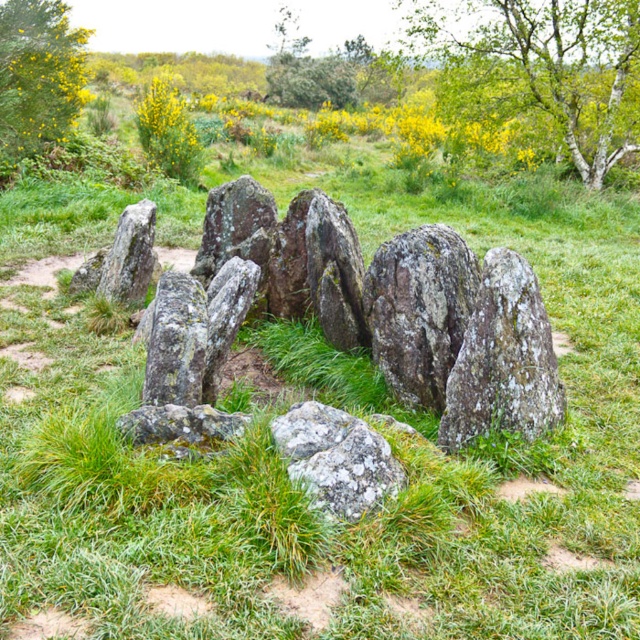
Identify the location of mossy stone circle at center. The height and width of the screenshot is (640, 640). (408, 310).

This screenshot has width=640, height=640. Find the location of `mossy stone circle at center`. mossy stone circle at center is located at coordinates (408, 310).

In order to click on mossy stone circle at center in this screenshot , I will do `click(408, 310)`.

Which is above, gray rough rock at center or rough gray rock at left?

rough gray rock at left is above.

Is gray rough rock at center in front of rough gray rock at left?

Yes, gray rough rock at center is closer to the viewer.

At what (x,y) coordinates should I click in order to perform the action: click on gray rough rock at center. Please return your answer as a coordinate pair (x, y). This screenshot has height=640, width=640. Looking at the image, I should click on (419, 308).

The height and width of the screenshot is (640, 640). What are the coordinates of `gray rough rock at center` in the screenshot? It's located at (419, 308).

Who is more forward, (276, 241) or (541, 42)?

Positioned in front is point (276, 241).

Who is positioned more to the right, mossy stone circle at center or green leafy tree at upper center?

green leafy tree at upper center is more to the right.

Is point (314, 225) closer to viewer compared to point (506, 92)?

Yes, point (314, 225) is closer to viewer.

You are a GUI agent. You are given a task and a screenshot of the screen. Output one action in this format:
    pyautogui.click(x=<x>, y=<y>)
    Task: Click on the mossy stone circle at center
    
    Given the screenshot: What is the action you would take?
    pyautogui.click(x=408, y=310)